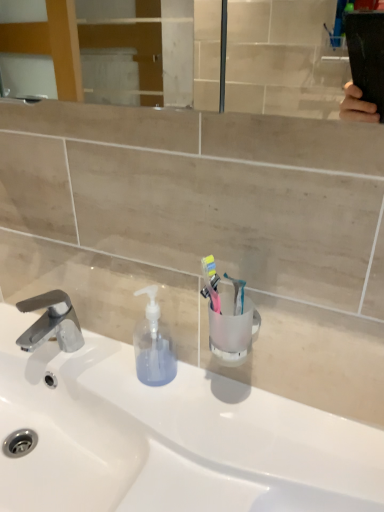
Question: Should I look upward or downward to see transparent plastic soap dispenser at center?

Choices:
 (A) up
 (B) down

Answer: (B)

Question: Does translucent plastic toothbrush at center, the second toothbrush from the left, appear on the left side of translucent plastic toothbrush at center, which is counted as the first toothbrush, starting from the left?

Choices:
 (A) no
 (B) yes

Answer: (A)

Question: Are translucent plastic toothbrush at center, the second toothbrush from the left, and translucent plastic toothbrush at center, which appears as the second toothbrush when viewed from the right, beside each other?

Choices:
 (A) no
 (B) yes

Answer: (B)

Question: Is translucent plastic toothbrush at center, the second toothbrush from the left, looking in the opposite direction of translucent plastic toothbrush at center, which appears as the second toothbrush when viewed from the right?

Choices:
 (A) yes
 (B) no

Answer: (B)

Question: Can you confirm if translucent plastic toothbrush at center, the first toothbrush positioned from the right, is smaller than translucent plastic toothbrush at center, which appears as the second toothbrush when viewed from the right?

Choices:
 (A) yes
 (B) no

Answer: (B)

Question: Does translucent plastic toothbrush at center, the second toothbrush from the left, come behind translucent plastic toothbrush at center, which appears as the second toothbrush when viewed from the right?

Choices:
 (A) yes
 (B) no

Answer: (A)

Question: Can you confirm if translucent plastic toothbrush at center, the second toothbrush from the left, is shorter than translucent plastic toothbrush at center, which appears as the second toothbrush when viewed from the right?

Choices:
 (A) yes
 (B) no

Answer: (B)

Question: Considering the relative sizes of transparent plastic soap dispenser at center and chrome metallic faucet at left in the image provided, is transparent plastic soap dispenser at center wider than chrome metallic faucet at left?

Choices:
 (A) yes
 (B) no

Answer: (B)

Question: Is chrome metallic faucet at left surrounded by transparent plastic soap dispenser at center?

Choices:
 (A) no
 (B) yes

Answer: (A)

Question: From a real-world perspective, is transparent plastic soap dispenser at center physically above chrome metallic faucet at left?

Choices:
 (A) no
 (B) yes

Answer: (B)

Question: Does transparent plastic soap dispenser at center have a lesser height compared to chrome metallic faucet at left?

Choices:
 (A) yes
 (B) no

Answer: (B)

Question: Considering the relative positions of transparent plastic soap dispenser at center and chrome metallic faucet at left in the image provided, is transparent plastic soap dispenser at center to the left of chrome metallic faucet at left from the viewer's perspective?

Choices:
 (A) no
 (B) yes

Answer: (A)

Question: From the image's perspective, is transparent plastic soap dispenser at center on chrome metallic faucet at left?

Choices:
 (A) yes
 (B) no

Answer: (A)

Question: Does white glossy sink at center have a lesser height compared to transparent plastic soap dispenser at center?

Choices:
 (A) yes
 (B) no

Answer: (A)